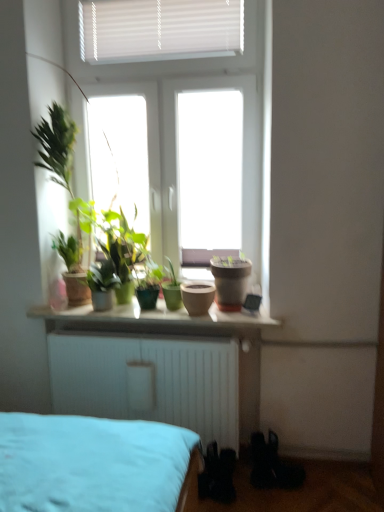
Find the location of a particular element. This screenshot has width=384, height=512. vacant area situated below green matte plant at center, which ranks as the 1th houseplant in left-to-right order (from a real-world perspective) is located at coordinates (105, 310).